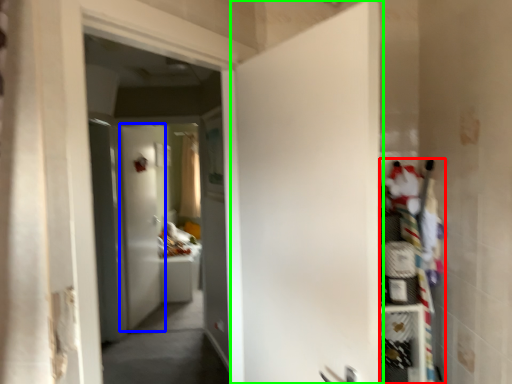
Question: Which object is positioned closest to shelf (highlighted by a red box)? Select from door (highlighted by a blue box) and door (highlighted by a green box).

Choices:
 (A) door
 (B) door

Answer: (B)